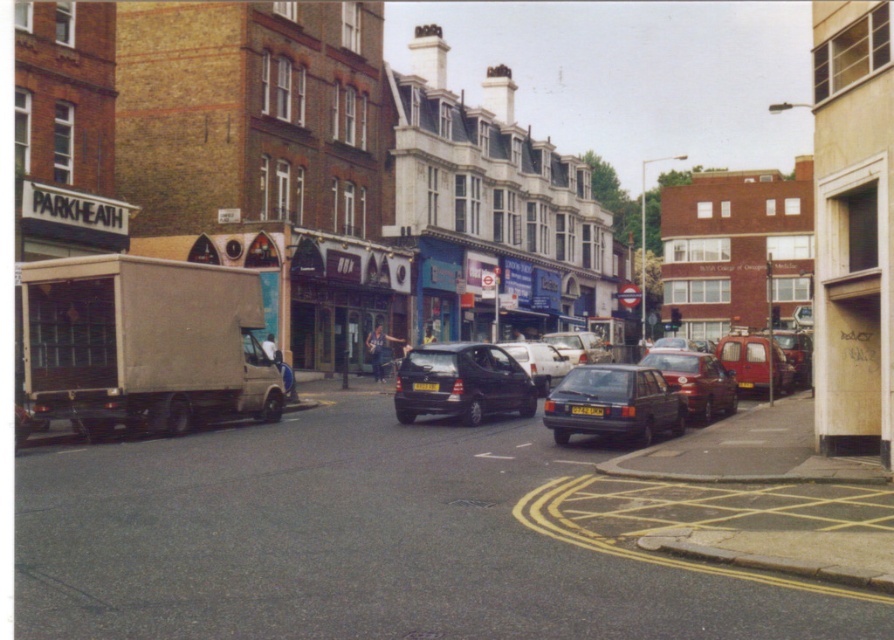
You are a pedestrian standing on the sidewalk in this urban street scene. You want to cross the street to reach the PARKHEATH building on the left. The crosswalk is 30 meters away. Can you safely cross before the shiny red car at center reaches you if it starts moving towards you at 10 meters per second?

The shiny red car at center is 20.77 meters away from you. If it moves towards you at 10 meters per second, it would take approximately 2.08 seconds to reach you. The crosswalk is 30 meters away, so at a normal walking speed of about 1.4 meters per second, it would take roughly 21.43 seconds to reach the other side. Since the car would arrive before you, it is not safe to cross.

You are standing at the point with coordinates (462, 381) in the image. What object are you located at?

You are located at the shiny black car at center, which is represented by the point with coordinates (462, 381).